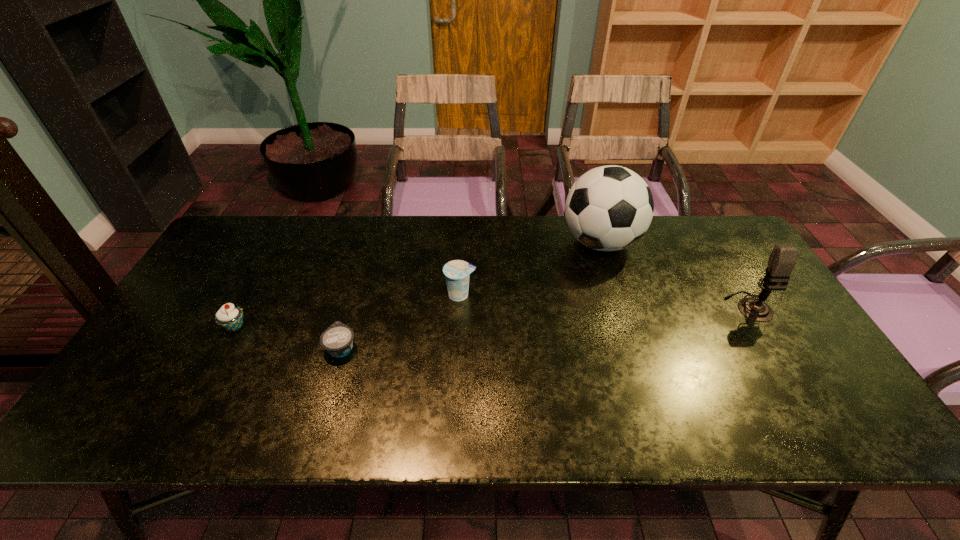
This screenshot has height=540, width=960. I want to click on free spot located 0.060m on the front-facing side of the rightmost object, so click(769, 340).

At what (x,y) coordinates should I click in order to perform the action: click on vacant space located on the left of the farther yogurt. Please return your answer as a coordinate pair (x, y). Image resolution: width=960 pixels, height=540 pixels. Looking at the image, I should click on (399, 295).

The width and height of the screenshot is (960, 540). I want to click on free space located on the front of the leftmost object, so click(180, 429).

Image resolution: width=960 pixels, height=540 pixels. What are the coordinates of `free region located on the back of the shorter yogurt` in the screenshot? It's located at (355, 300).

In order to click on object at the far edge in this screenshot , I will do `click(608, 208)`.

Locate an element on the screen. The image size is (960, 540). object that is at the left edge is located at coordinates (230, 317).

At what (x,y) coordinates should I click in order to perform the action: click on object that is at the right edge. Please return your answer as a coordinate pair (x, y). Looking at the image, I should click on (782, 260).

Find the location of a particular element. blank space at the far edge of the desktop is located at coordinates (295, 232).

I want to click on vacant space at the near edge, so [422, 436].

Identify the location of free space at the left edge of the desktop. The height and width of the screenshot is (540, 960). (x=203, y=322).